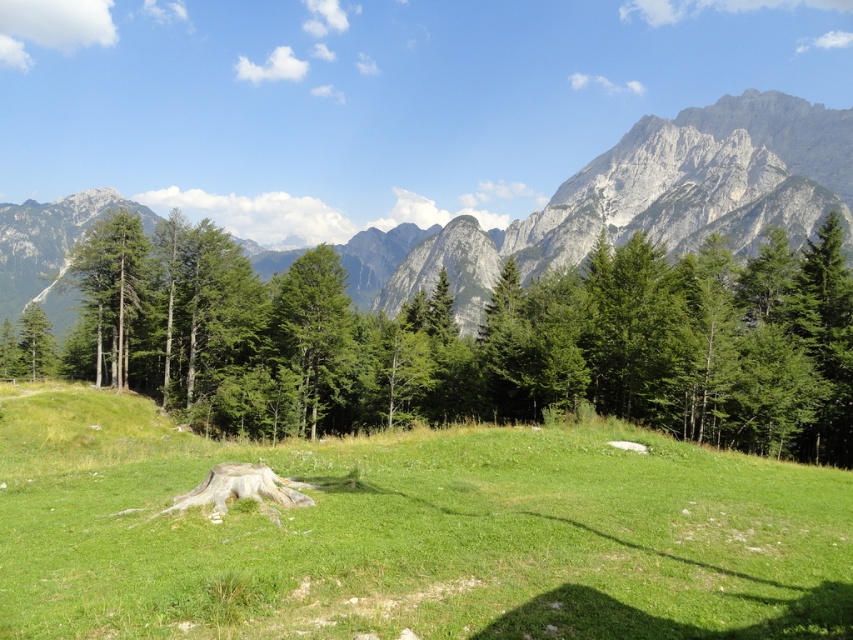
Question: Estimate the real-world distances between objects in this image. Which object is closer to the green grassy field at center?

Choices:
 (A) green leafy tree at center
 (B) green matte tree at left
 (C) rugged granite mountain at center

Answer: (A)

Question: Where is green grassy field at center located in relation to green leafy tree at center in the image?

Choices:
 (A) below
 (B) above

Answer: (A)

Question: Can you confirm if rugged granite mountain at center is positioned to the left of green matte tree at left?

Choices:
 (A) no
 (B) yes

Answer: (B)

Question: Which of the following is the farthest from the observer?

Choices:
 (A) (112, 289)
 (B) (283, 394)
 (C) (468, 228)
 (D) (335, 630)

Answer: (C)

Question: Among these objects, which one is farthest from the camera?

Choices:
 (A) green grassy field at center
 (B) rugged granite mountain at center
 (C) green matte tree at left

Answer: (C)

Question: Can you confirm if green leafy tree at center is bigger than rugged granite mountain at center?

Choices:
 (A) no
 (B) yes

Answer: (A)